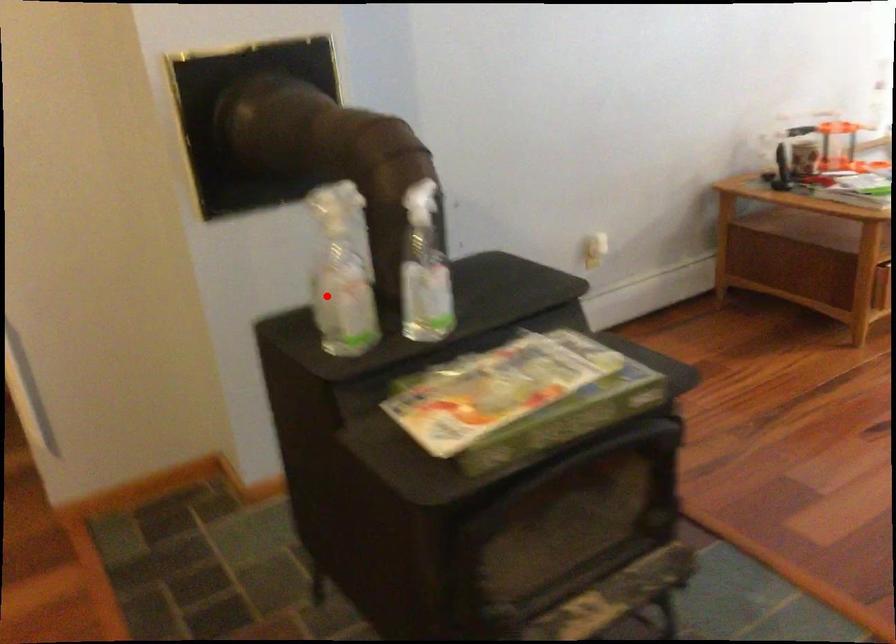
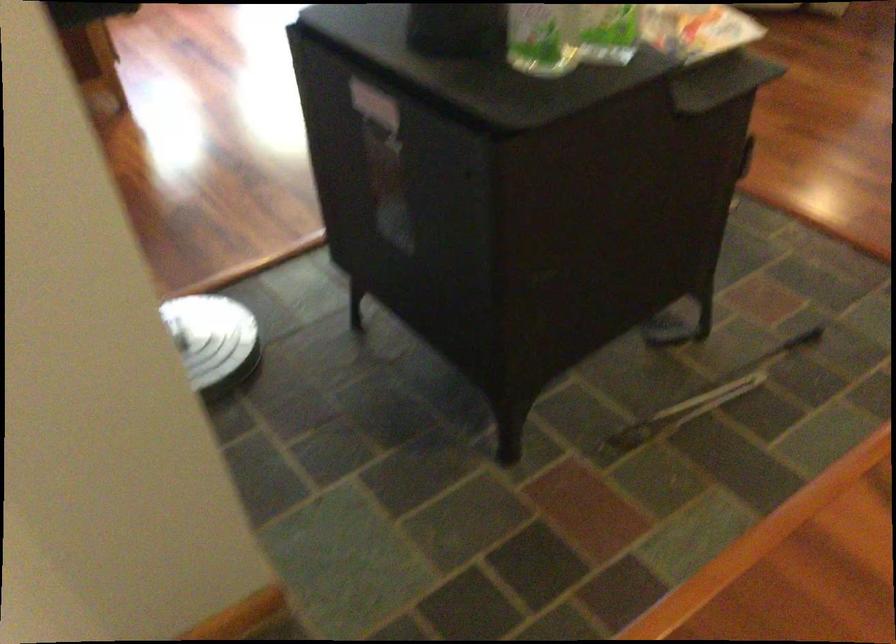
Question: I am providing you with two images of the same scene from different viewpoints. A red point is marked on the first image. Is the red point's position out of view in image 2?

Choices:
 (A) Yes
 (B) No

Answer: (B)